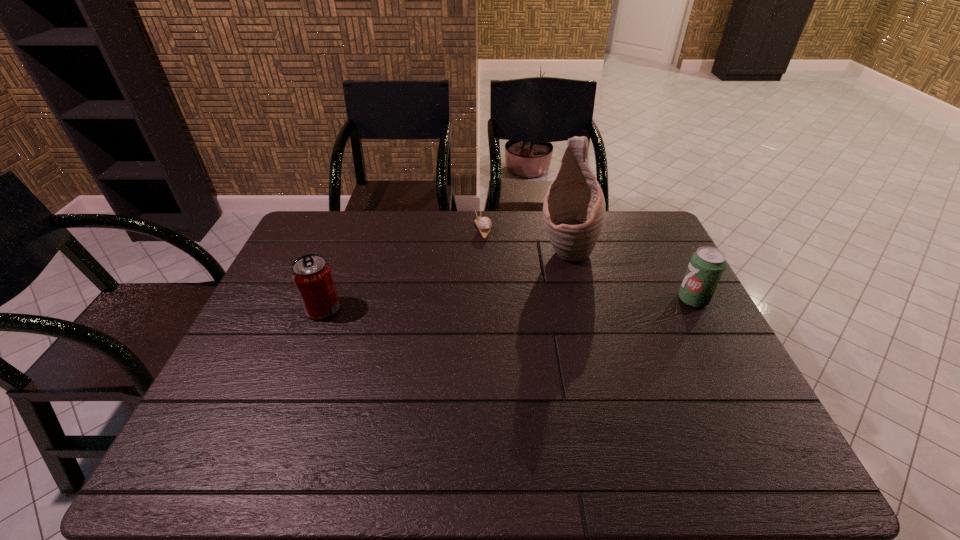
Where is `unoccupied position between the right soda and the shortest object`? The width and height of the screenshot is (960, 540). unoccupied position between the right soda and the shortest object is located at coordinates (588, 264).

The height and width of the screenshot is (540, 960). I want to click on free space that is in between the escargot and the left soda, so click(x=403, y=269).

At what (x,y) coordinates should I click in order to perform the action: click on vacant area that lies between the third object from right to left and the tallest object. Please return your answer as a coordinate pair (x, y). This screenshot has height=540, width=960. Looking at the image, I should click on (525, 240).

This screenshot has height=540, width=960. What are the coordinates of `vacant area between the rightmost object and the escargot` in the screenshot? It's located at (588, 264).

Where is `object that is the second closest to the right soda`? object that is the second closest to the right soda is located at coordinates (484, 224).

Identify which object is located as the second nearest to the leftmost object. Please provide its 2D coordinates. Your answer should be formatted as a tuple, i.e. [(x, y)], where the tuple contains the x and y coordinates of a point satisfying the conditions above.

[(574, 210)]

Locate an element on the screen. This screenshot has height=540, width=960. free location that satisfies the following two spatial constraints: 1. on the back side of the tallest object; 2. on the right side of the left soda is located at coordinates coord(345,251).

Where is `free location that satisfies the following two spatial constraints: 1. on the front side of the escargot; 2. on the right side of the pitcher`? This screenshot has height=540, width=960. free location that satisfies the following two spatial constraints: 1. on the front side of the escargot; 2. on the right side of the pitcher is located at coordinates (483, 251).

Identify the location of vacant point that satisfies the following two spatial constraints: 1. on the front side of the third object from right to left; 2. on the left side of the tallest object. (483, 251).